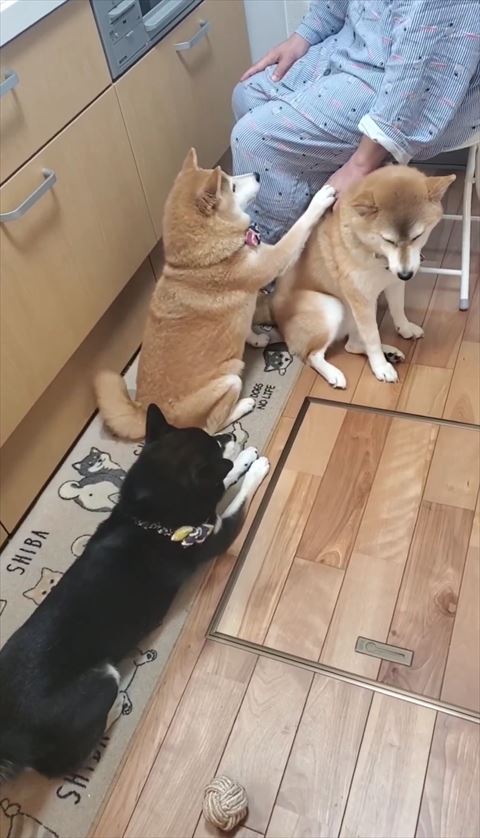
Find the location of a particular element. The height and width of the screenshot is (838, 480). wood floor is located at coordinates (311, 730), (391, 504), (446, 344).